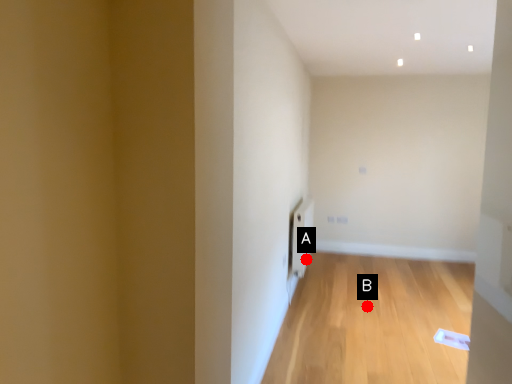
Question: Two points are circled on the image, labeled by A and B beside each circle. Which point appears farthest from the camera in this image?

Choices:
 (A) A is further
 (B) B is further

Answer: (A)